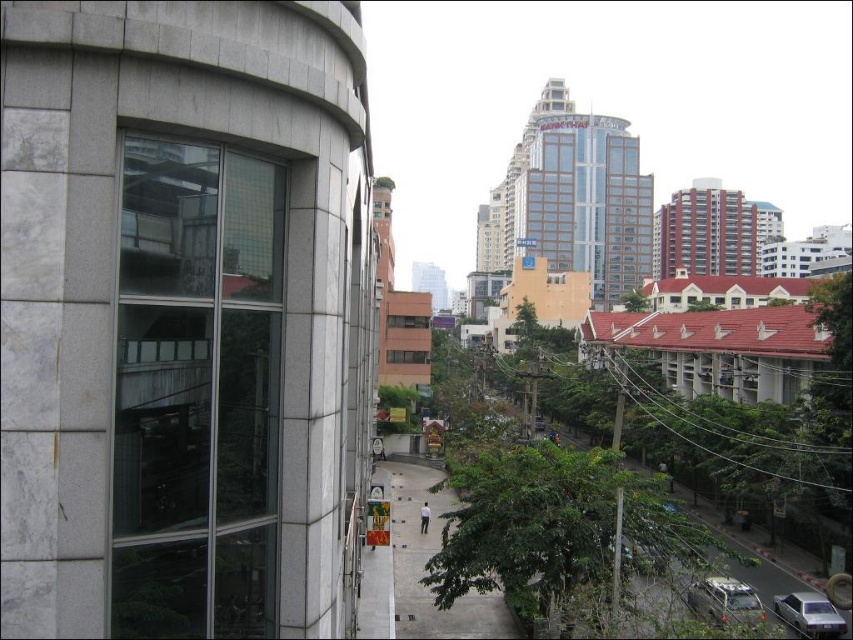
Question: Is metallic silver car at lower right below silver metallic sedan at bottom right?

Choices:
 (A) no
 (B) yes

Answer: (A)

Question: Which of the following is the farthest from the observer?

Choices:
 (A) metallic silver car at lower right
 (B) transparent glass window at left

Answer: (A)

Question: Which point appears closest to the camera in this image?

Choices:
 (A) (809, 609)
 (B) (750, 616)

Answer: (B)

Question: From the image, what is the correct spatial relationship of transparent glass window at left in relation to metallic silver car at lower right?

Choices:
 (A) below
 (B) above

Answer: (B)

Question: Can you confirm if transparent glass window at left is bigger than silver metallic sedan at bottom right?

Choices:
 (A) yes
 (B) no

Answer: (B)

Question: Which point is farther from the camera taking this photo?

Choices:
 (A) (735, 580)
 (B) (144, 515)
 (C) (804, 609)

Answer: (A)